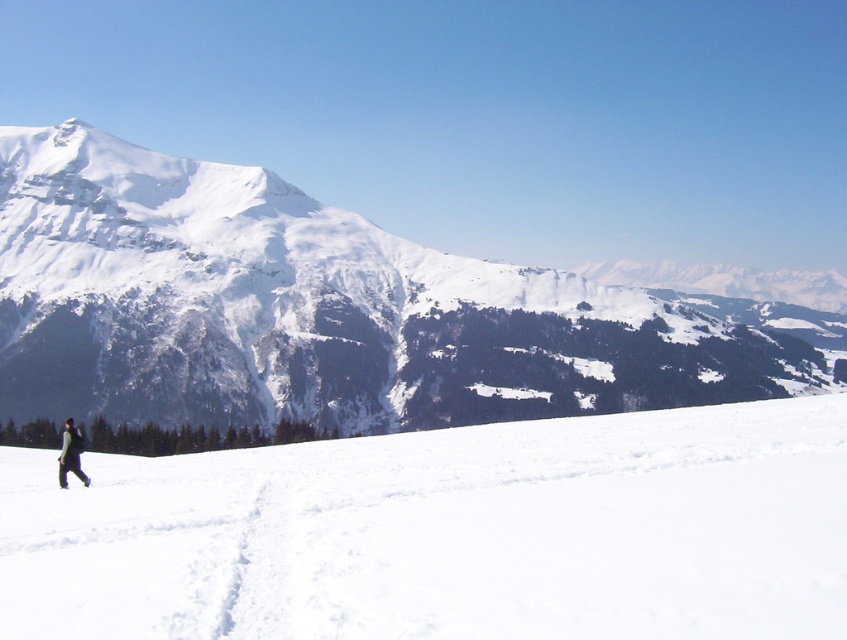
You are a hiker planning to traverse the snowy field in the winter landscape. There is a white snow covered mountain at left located at point (314, 308). Can you determine the direction of the mountain relative to your current position?

The white snow covered mountain at left is located at point (314, 308), which is to the left of your current position.